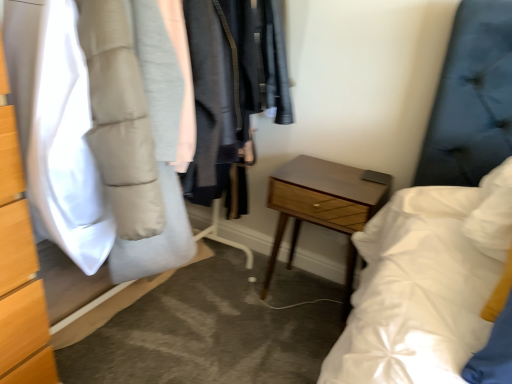
Find the location of a particular element. The height and width of the screenshot is (384, 512). vacant space in woodenmaterial/texturenightstand at center (from a real-world perspective) is located at coordinates 316,291.